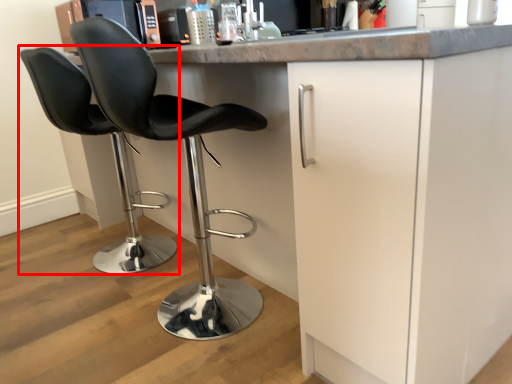
Question: From the image's perspective, what is the correct spatial relationship of chair (annotated by the red box) in relation to chair?

Choices:
 (A) above
 (B) below

Answer: (A)